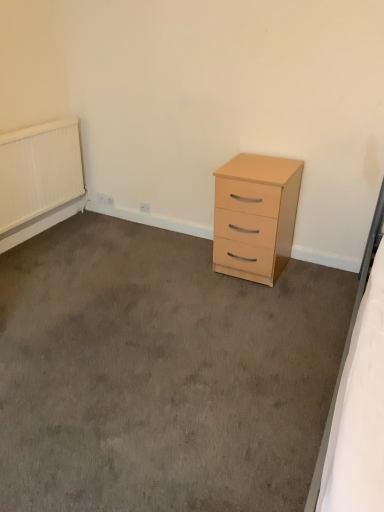
The width and height of the screenshot is (384, 512). I want to click on vacant space underneath white textured radiator at upper left (from a real-world perspective), so click(x=49, y=229).